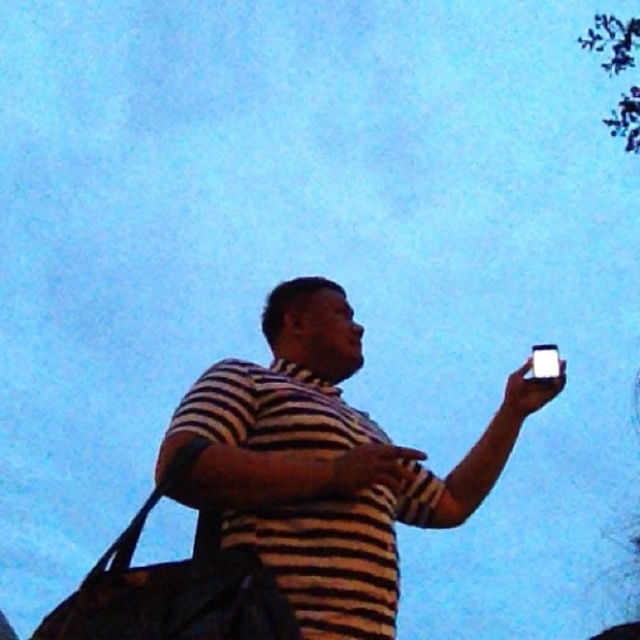
Does striped fabric shirt at center have a lesser height compared to white glossy smartphone at upper right?

No, striped fabric shirt at center is not shorter than white glossy smartphone at upper right.

Is striped fabric shirt at center taller than white glossy smartphone at upper right?

Yes.

This screenshot has width=640, height=640. I want to click on striped fabric shirt at center, so click(x=324, y=465).